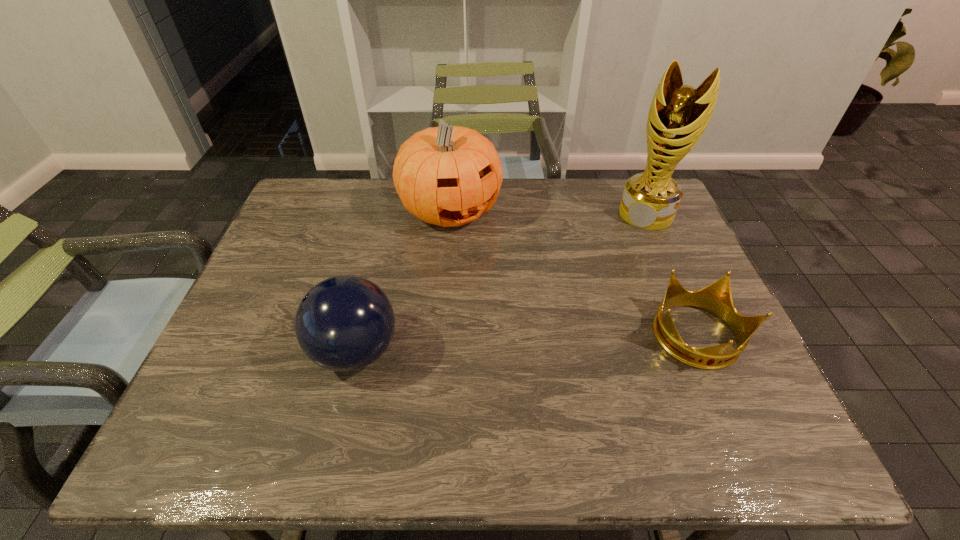
The image size is (960, 540). I want to click on the third tallest object, so (x=344, y=323).

You are a GUI agent. You are given a task and a screenshot of the screen. Output one action in this format:
    pyautogui.click(x=<x>, y=<y>)
    Task: Click on the crown
    
    Given the screenshot: What is the action you would take?
    pyautogui.click(x=716, y=298)

This screenshot has width=960, height=540. Find the location of `award`. award is located at coordinates (678, 115).

Where is `pumpkin`? This screenshot has width=960, height=540. pumpkin is located at coordinates (449, 176).

In order to click on vacant area situated 0.150m on the surface of the second shortest object near the finger holes in this screenshot , I will do coord(245,352).

The height and width of the screenshot is (540, 960). I want to click on vacant area situated 0.180m on the surface of the second shortest object near the finger holes, so click(x=231, y=352).

You are a GUI agent. You are given a task and a screenshot of the screen. Output one action in this format:
    pyautogui.click(x=<x>, y=<y>)
    Task: Click on the free space located 0.070m on the surface of the second shortest object near the finger holes
    
    Given the screenshot: What is the action you would take?
    pyautogui.click(x=280, y=352)

Where is `vacant space located 0.060m on the front of the shortest object`? This screenshot has width=960, height=540. vacant space located 0.060m on the front of the shortest object is located at coordinates (724, 402).

Identify the location of free spot located on the front-facing side of the tallest object. Image resolution: width=960 pixels, height=540 pixels. (584, 315).

I want to click on free location located on the front-facing side of the tallest object, so click(632, 237).